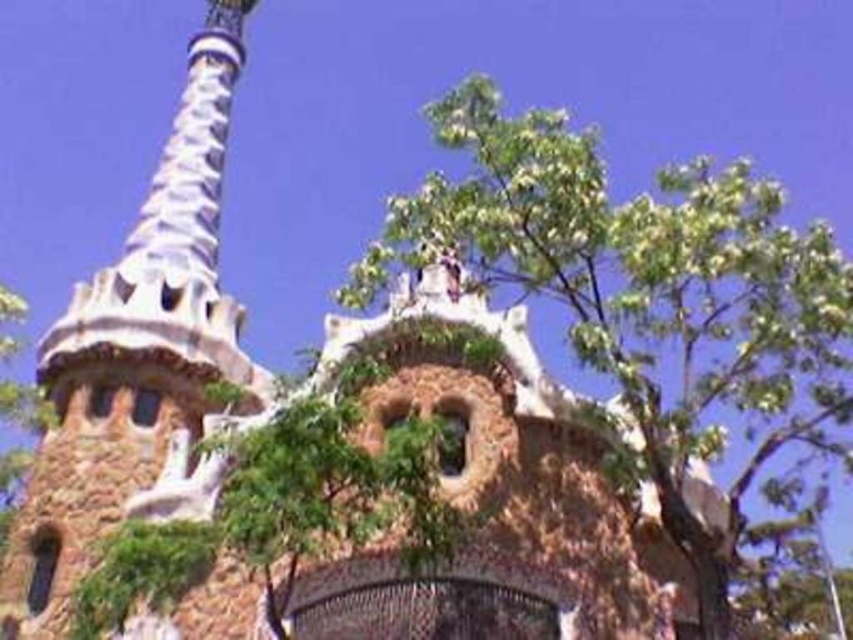
You are an architect analyzing the structure. Which object, the green leafy tree at upper center or the brown stone tower at upper left, has a larger size in the image?

The green leafy tree at upper center is bigger than the brown stone tower at upper left according to the description.

From the picture: Please look at the image of the architectural structure. There is a green leafy tree at upper center and a point marked at coordinates (646, 294). Can you tell me if the green leafy tree at upper center is exactly at that point?

The green leafy tree at upper center is located at point (646, 294), so yes, it is exactly at that point.

You are an architect analyzing the structure of Park Gaud in Barcelona. You observe the green leafy tree at upper center and the brown stone tower at upper left. Which object has a greater height?

The brown stone tower at upper left is taller than the green leafy tree at upper center.